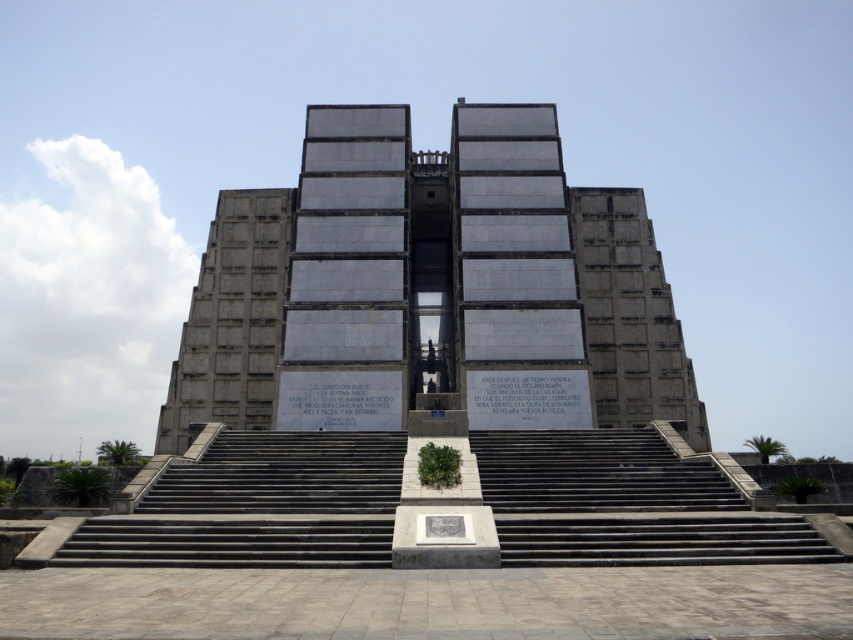
You are standing in front of the monument and see a point marked at coordinates (x=431, y=289). What object is located at that point?

The point at (x=431, y=289) indicates the gray concrete pyramid at center.

You are standing in front of the monument and want to approach the entrance. You see the gray concrete pyramid at center and the gray concrete stairs at center. Which object should you go around to reach the stairs?

You should go around the gray concrete pyramid at center because the gray concrete stairs at center is behind it.

You are standing at the base of the monument and want to take a photo of the entrance. There are two points marked on the ground in front of you. One is at coordinates point (492, 314) and the other is at point (349, 464). Which point should you stand at to ensure the monument is fully visible in your photo without any obstructions?

You should stand at point (349, 464) because point (492, 314) is behind it, so standing at the forward point will allow the monument to be fully visible without obstruction.